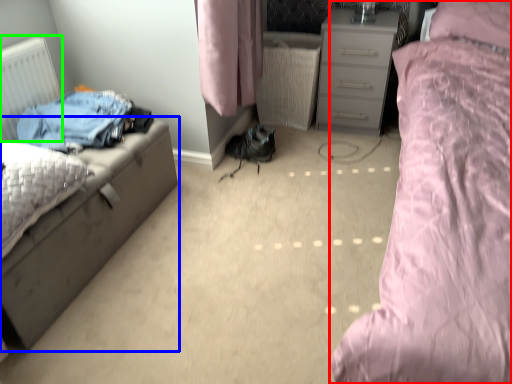
Question: Based on their relative distances, which object is farther from bed (highlighted by a red box)? Choose from nightstand (highlighted by a blue box) and radiator (highlighted by a green box).

Choices:
 (A) nightstand
 (B) radiator

Answer: (B)